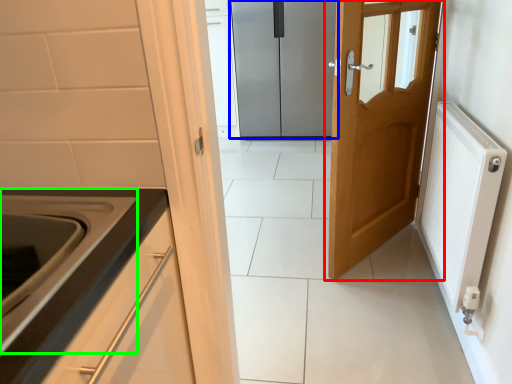
Question: Which is nearer to the door (highlighted by a red box)? door (highlighted by a blue box) or oven (highlighted by a green box).

Choices:
 (A) door
 (B) oven

Answer: (B)